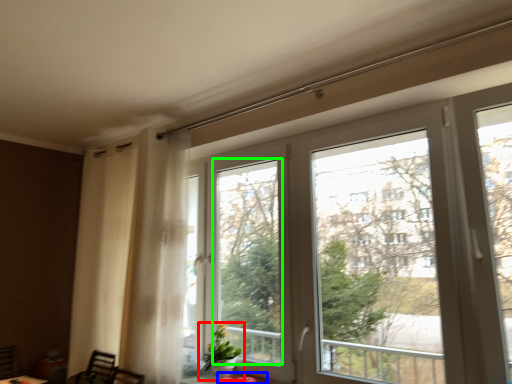
Question: Estimate the real-world distances between objects in this image. Which object is closer to houseplant (highlighted by a red box), table (highlighted by a blue box) or window screen (highlighted by a green box)?

Choices:
 (A) table
 (B) window screen

Answer: (A)